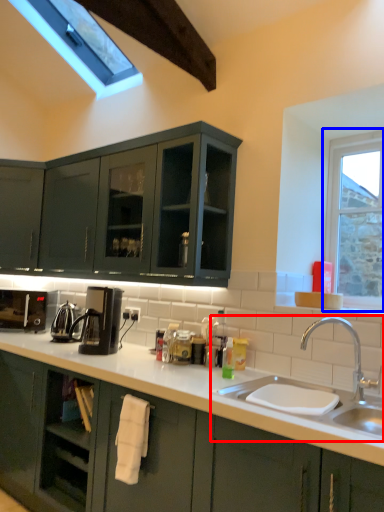
Question: Which of the following is the farthest to the observer, sink (highlighted by a red box) or window (highlighted by a blue box)?

Choices:
 (A) sink
 (B) window

Answer: (B)